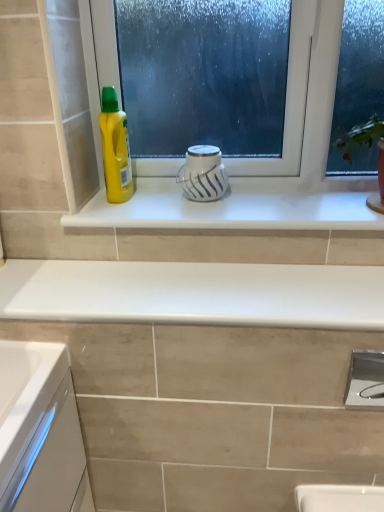
Question: Does white glossy window sill at center have a greater height compared to white glossy mug at center?

Choices:
 (A) no
 (B) yes

Answer: (A)

Question: Is white glossy window sill at center further to the viewer compared to white glossy mug at center?

Choices:
 (A) no
 (B) yes

Answer: (A)

Question: Is white glossy window sill at center turned away from white glossy mug at center?

Choices:
 (A) no
 (B) yes

Answer: (A)

Question: Considering the relative sizes of white glossy window sill at center and white glossy mug at center in the image provided, is white glossy window sill at center thinner than white glossy mug at center?

Choices:
 (A) yes
 (B) no

Answer: (B)

Question: From the image's perspective, is white glossy window sill at center below white glossy mug at center?

Choices:
 (A) no
 (B) yes

Answer: (B)

Question: Can you confirm if white glossy window sill at center is bigger than white glossy mug at center?

Choices:
 (A) yes
 (B) no

Answer: (A)

Question: Is white glossy mug at center looking in the opposite direction of white glossy countertop at center?

Choices:
 (A) yes
 (B) no

Answer: (B)

Question: Is white glossy mug at center aimed at white glossy countertop at center?

Choices:
 (A) no
 (B) yes

Answer: (A)

Question: Can you confirm if white glossy mug at center is smaller than white glossy countertop at center?

Choices:
 (A) yes
 (B) no

Answer: (A)

Question: Is white glossy mug at center positioned behind white glossy countertop at center?

Choices:
 (A) no
 (B) yes

Answer: (B)

Question: Can you confirm if white glossy mug at center is positioned to the left of white glossy countertop at center?

Choices:
 (A) no
 (B) yes

Answer: (A)

Question: Can you confirm if white glossy mug at center is shorter than white glossy countertop at center?

Choices:
 (A) no
 (B) yes

Answer: (A)

Question: Is yellow plastic bottle at left positioned with its back to white glossy countertop at center?

Choices:
 (A) no
 (B) yes

Answer: (A)